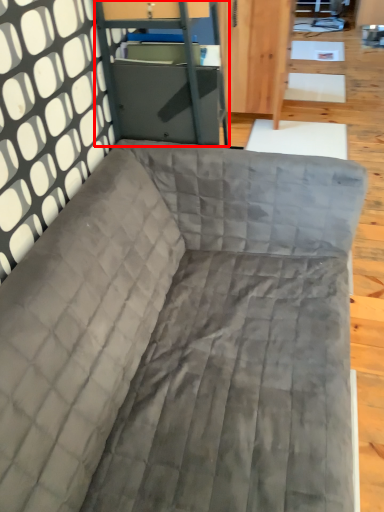
Question: From the image's perspective, where is file cabinet (annotated by the red box) located in relation to studio couch in the image?

Choices:
 (A) below
 (B) above

Answer: (B)